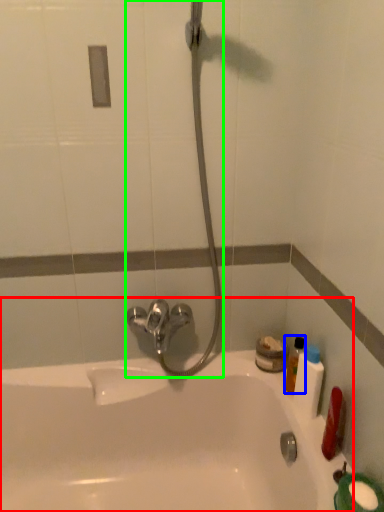
Question: Based on their relative distances, which object is farther from bathtub (highlighted by a red box)? Choose from mouthwash (highlighted by a blue box) and shower (highlighted by a green box).

Choices:
 (A) mouthwash
 (B) shower

Answer: (A)